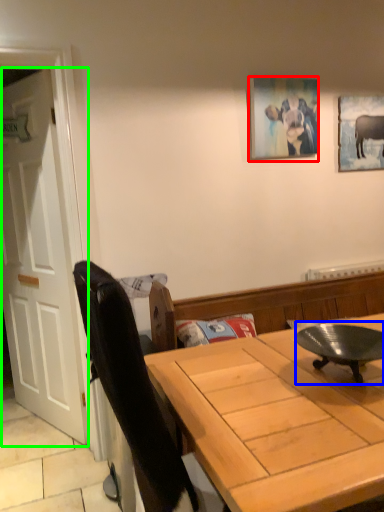
Question: Which object is the closest to the picture frame (highlighted by a red box)? Choose among these: round table (highlighted by a blue box) or door (highlighted by a green box).

Choices:
 (A) round table
 (B) door

Answer: (A)